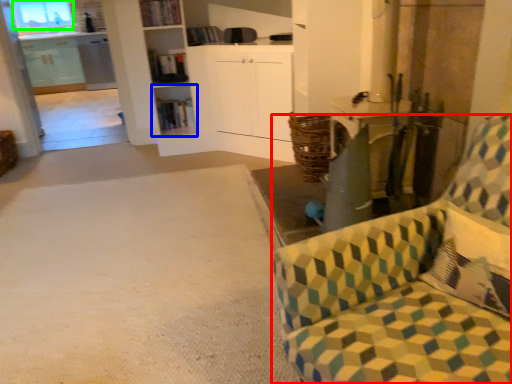
Question: Based on their relative distances, which object is farther from chair (highlighted by a red box)? Choose from shelf (highlighted by a blue box) and window (highlighted by a green box).

Choices:
 (A) shelf
 (B) window

Answer: (B)